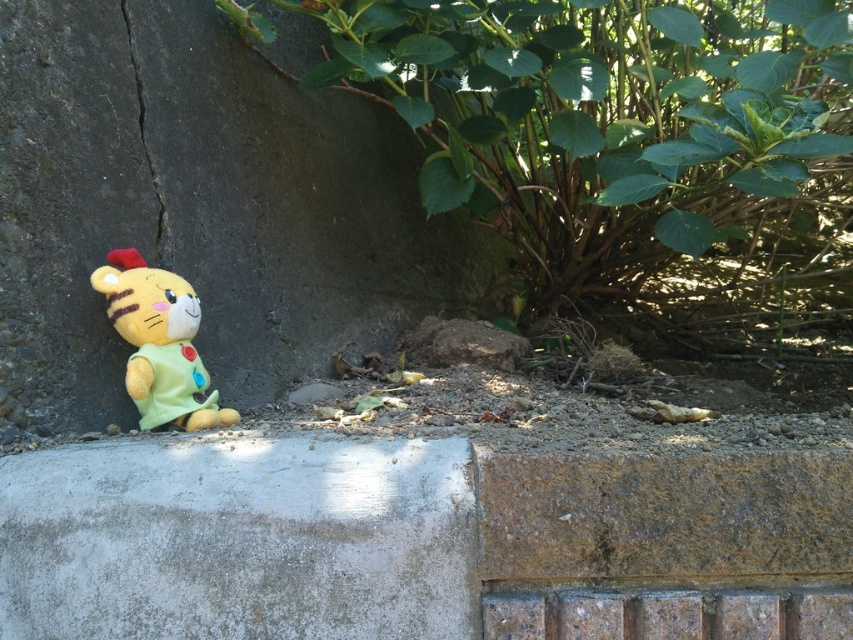
Which is above, smooth concrete wall at lower left or green leafy bush at center?

green leafy bush at center is higher up.

Is smooth concrete wall at lower left thinner than green leafy bush at center?

Correct, smooth concrete wall at lower left's width is less than green leafy bush at center's.

Where is `smooth concrete wall at lower left`? This screenshot has height=640, width=853. smooth concrete wall at lower left is located at coordinates (200, 208).

Can you confirm if soft plush cat at lower left is positioned to the right of black concrete crack at left?

Yes, soft plush cat at lower left is to the right of black concrete crack at left.

Between soft plush cat at lower left and black concrete crack at left, which one has less height?

With less height is soft plush cat at lower left.

You are a GUI agent. You are given a task and a screenshot of the screen. Output one action in this format:
    pyautogui.click(x=<x>, y=<y>)
    Task: Click on the soft plush cat at lower left
    This screenshot has height=640, width=853.
    Given the screenshot: What is the action you would take?
    pyautogui.click(x=160, y=342)

Which of these two, green leafy bush at center or black concrete crack at left, stands taller?

green leafy bush at center

Which is above, green leafy bush at center or black concrete crack at left?

green leafy bush at center is higher up.

This screenshot has width=853, height=640. What do you see at coordinates (589, 116) in the screenshot?
I see `green leafy bush at center` at bounding box center [589, 116].

Find the location of `green leafy bush at center`. green leafy bush at center is located at coordinates (589, 116).